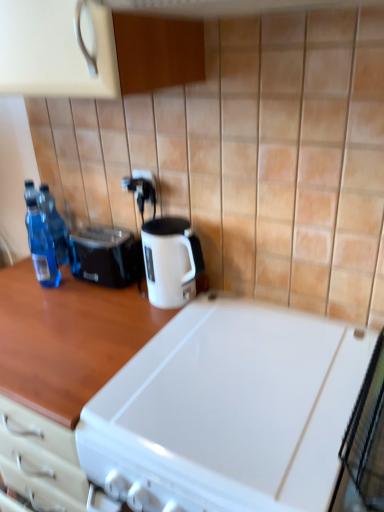
Question: Does white plastic electric outlet at center, the first electric outlet ordered from the bottom, appear on the right side of black plastic toaster at left?

Choices:
 (A) no
 (B) yes

Answer: (B)

Question: Would you say black plastic toaster at left is part of white plastic electric outlet at center, the first electric outlet ordered from the bottom,'s contents?

Choices:
 (A) no
 (B) yes

Answer: (A)

Question: Is white plastic electric outlet at center, positioned as the 2th electric outlet in top-to-bottom order, thinner than black plastic toaster at left?

Choices:
 (A) no
 (B) yes

Answer: (B)

Question: Is white plastic electric outlet at center, the first electric outlet ordered from the bottom, shorter than black plastic toaster at left?

Choices:
 (A) yes
 (B) no

Answer: (A)

Question: Can we say white plastic electric outlet at center, the first electric outlet ordered from the bottom, lies outside black plastic toaster at left?

Choices:
 (A) no
 (B) yes

Answer: (B)

Question: Is white glossy electric kettle at center taller or shorter than black plastic toaster at left?

Choices:
 (A) tall
 (B) short

Answer: (A)

Question: Based on their sizes in the image, would you say white glossy electric kettle at center is bigger or smaller than black plastic toaster at left?

Choices:
 (A) small
 (B) big

Answer: (B)

Question: From a real-world perspective, is white glossy electric kettle at center physically located above or below black plastic toaster at left?

Choices:
 (A) below
 (B) above

Answer: (B)

Question: In the image, is white glossy electric kettle at center positioned in front of or behind black plastic toaster at left?

Choices:
 (A) front
 (B) behind

Answer: (A)

Question: Considering the relative positions of white glossy electric kettle at center and woodenmaterial/texturecountertop at center, arranged as the 2th countertop when viewed from the right, in the image provided, is white glossy electric kettle at center to the left or to the right of woodenmaterial/texturecountertop at center, arranged as the 2th countertop when viewed from the right,?

Choices:
 (A) right
 (B) left

Answer: (A)

Question: Is white glossy electric kettle at center wider or thinner than woodenmaterial/texturecountertop at center, marked as the first countertop in a left-to-right arrangement?

Choices:
 (A) thin
 (B) wide

Answer: (A)

Question: From the image's perspective, is white glossy electric kettle at center positioned above or below woodenmaterial/texturecountertop at center, marked as the first countertop in a left-to-right arrangement?

Choices:
 (A) below
 (B) above

Answer: (B)

Question: Is white glossy electric kettle at center inside the boundaries of woodenmaterial/texturecountertop at center, marked as the first countertop in a left-to-right arrangement, or outside?

Choices:
 (A) outside
 (B) inside

Answer: (A)

Question: From the image's perspective, is transparent plastic bottles at left, marked as the second bottle in a front-to-back arrangement, above or below woodenmaterial/texturecountertop at center, marked as the first countertop in a left-to-right arrangement?

Choices:
 (A) above
 (B) below

Answer: (A)

Question: From a real-world perspective, is transparent plastic bottles at left, arranged as the first bottle when viewed from the back, physically located above or below woodenmaterial/texturecountertop at center, arranged as the 2th countertop when viewed from the right?

Choices:
 (A) above
 (B) below

Answer: (A)